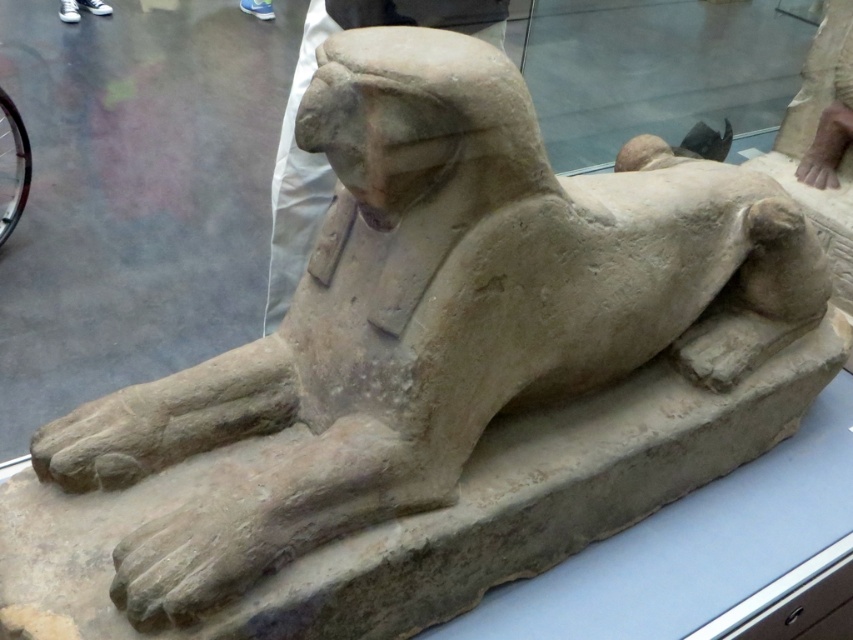
Question: Which object is closer to the camera taking this photo?

Choices:
 (A) stone statue at center
 (B) white canvas shoes at upper left

Answer: (A)

Question: Does stone statue at center appear over white canvas shoes at upper left?

Choices:
 (A) yes
 (B) no

Answer: (B)

Question: Is stone statue at center further to camera compared to white canvas shoes at upper left?

Choices:
 (A) yes
 (B) no

Answer: (B)

Question: In this image, where is stone statue at center located relative to white canvas shoes at upper left?

Choices:
 (A) above
 (B) below

Answer: (B)

Question: Which point is farther from the camera taking this photo?

Choices:
 (A) (325, 1)
 (B) (68, 0)

Answer: (B)